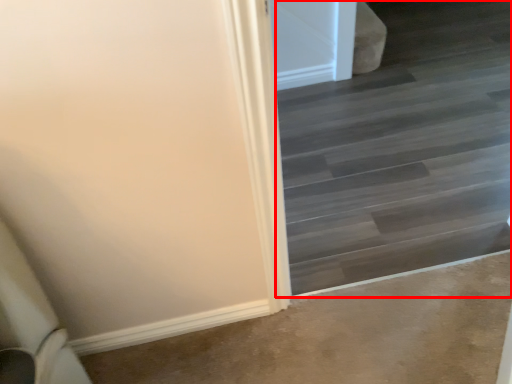
Question: From the image's perspective, where is stairwell (annotated by the red box) located in relation to concrete in the image?

Choices:
 (A) above
 (B) below

Answer: (A)